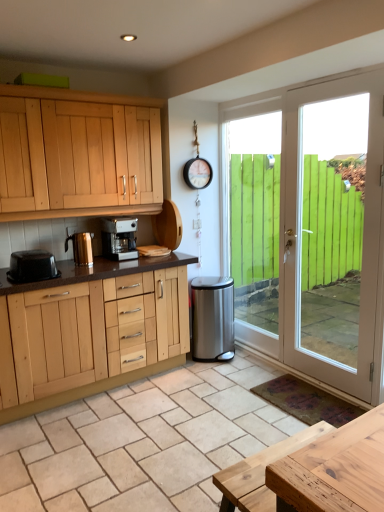
Question: From the image's perspective, is white glossy door at right located above or below shiny metallic kettle at left, which ranks as the 2th kitchen appliance in right-to-left order?

Choices:
 (A) above
 (B) below

Answer: (B)

Question: From their relative heights in the image, would you say white glossy door at right is taller or shorter than shiny metallic kettle at left, which ranks as the 2th kitchen appliance in right-to-left order?

Choices:
 (A) tall
 (B) short

Answer: (A)

Question: Which of these objects is positioned farthest from the black plastic toaster at left, the 1th kitchen appliance positioned from the left?

Choices:
 (A) satin silver coffee maker at center, the first kitchen appliance viewed from the right
 (B) white glossy door at right
 (C) natural wood table at lower right
 (D) stainless steel trash can at lower right
 (E) shiny metallic kettle at left, which ranks as the 2th kitchen appliance in right-to-left order

Answer: (B)

Question: Which is nearer to the stainless steel trash can at lower right?

Choices:
 (A) shiny metallic kettle at left, which appears as the second kitchen appliance when viewed from the left
 (B) white glossy door at right
 (C) natural wood table at lower right
 (D) black plastic toaster at left, which is the 3th kitchen appliance from right to left
 (E) satin silver coffee maker at center, which is the 3th kitchen appliance from left to right

Answer: (B)